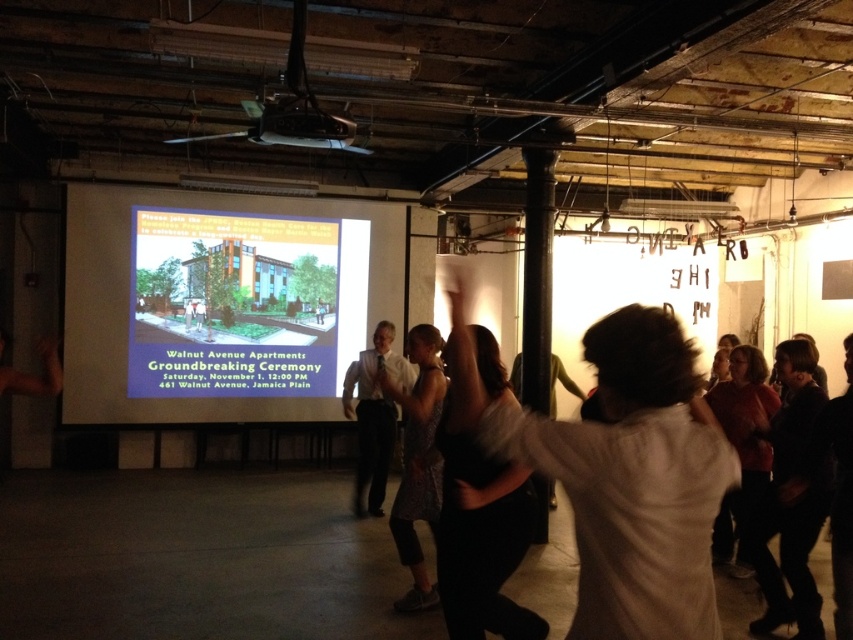
Question: In this image, where is white shirt at center located relative to matte black projector at upper center?

Choices:
 (A) above
 (B) below

Answer: (B)

Question: Which of these objects is positioned farthest from the matte black projector at upper center?

Choices:
 (A) matte green building at center
 (B) printed fabric dress at center
 (C) matte white projector screen at center

Answer: (C)

Question: Can you confirm if matte white projector screen at center is positioned to the right of white shirt at center?

Choices:
 (A) yes
 (B) no

Answer: (B)

Question: Which of the following is the farthest from the observer?

Choices:
 (A) printed fabric dress at center
 (B) matte white projector screen at center

Answer: (B)

Question: Considering the relative positions of matte white projector screen at center and printed fabric dress at center in the image provided, where is matte white projector screen at center located with respect to printed fabric dress at center?

Choices:
 (A) below
 (B) above

Answer: (B)

Question: Which object is closer to the camera taking this photo?

Choices:
 (A) white shirt at center
 (B) printed fabric dress at center
 (C) matte black projector at upper center
 (D) matte white projector screen at center

Answer: (B)